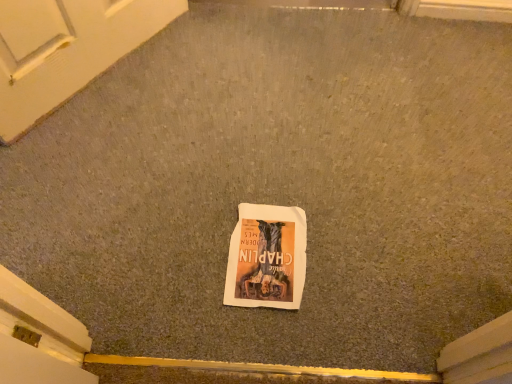
This screenshot has width=512, height=384. I want to click on unoccupied space behind white paper at center, so click(267, 178).